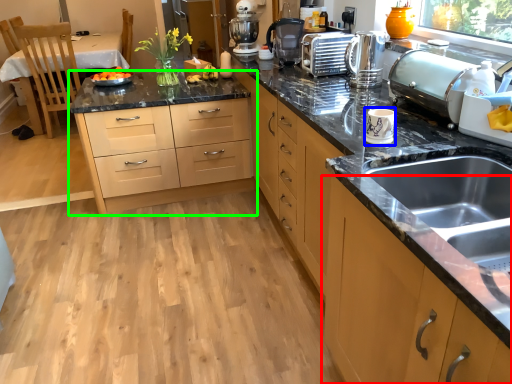
Question: Which object is positioned farthest from cabinetry (highlighted by a red box)? Select from appliance (highlighted by a blue box) and chest of drawers (highlighted by a green box).

Choices:
 (A) appliance
 (B) chest of drawers

Answer: (B)